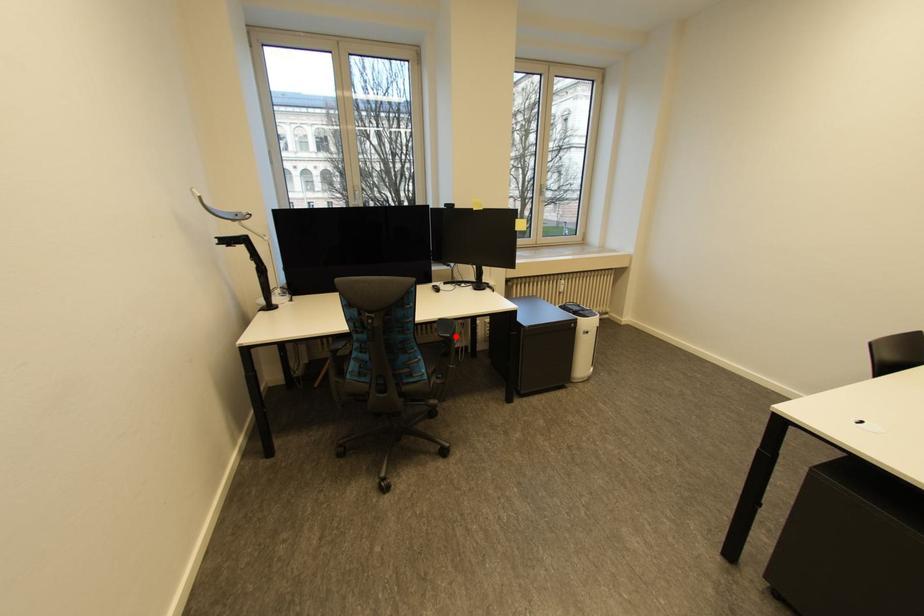
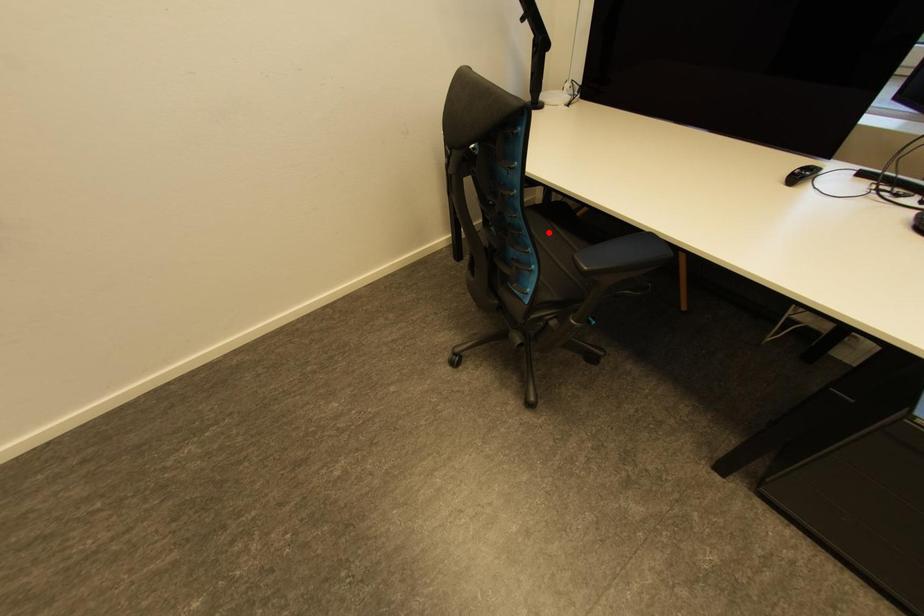
I am providing you with two images of the same scene from different viewpoints. A red point is marked on the first image and another point is marked on the second image. Is the marked point in image1 the same physical position as the marked point in image2?

No